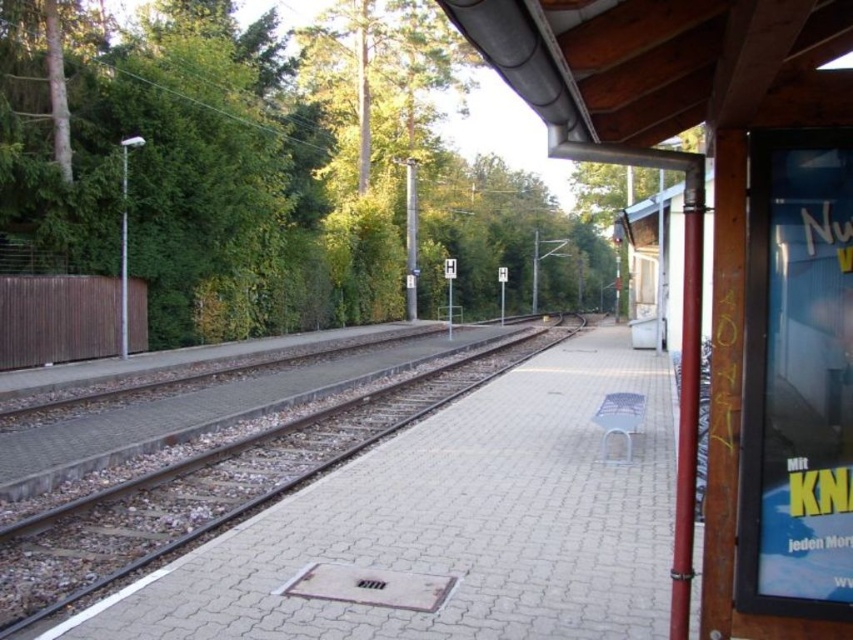
Looking at this image, you are a commuter waiting on the platform and want to check the schedule. The blue glossy poster at right and the brown gravel track at center are in your view. Which object is higher in position?

The blue glossy poster at right is above the brown gravel track at center, so the blue glossy poster at right is higher in position.

You are standing on the platform at the railway station and see the blue glossy poster at right. If you want to reach the poster quickly, should you walk towards the trees in the distance or towards the bench?

The blue glossy poster at right is 9.93 feet away from viewer, so you should walk towards the bench since it is closer than the trees in the distance.

You are a traveler standing on the platform and want to place a small backpack between the blue glossy poster at right and the brown gravel track at center. Can you fit the backpack there?

The blue glossy poster at right is smaller than the brown gravel track at center, so there should be enough space to place the backpack between them.